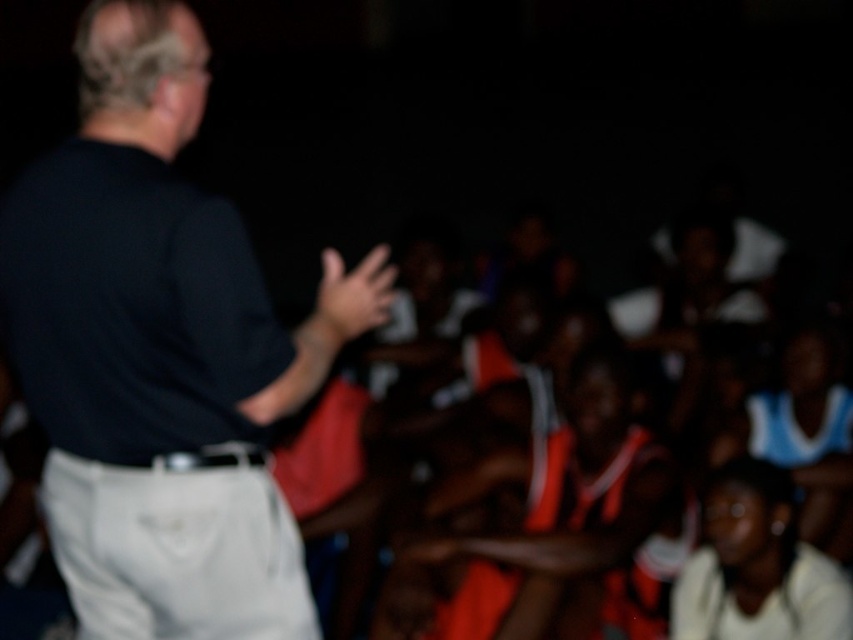
You are standing in the scene and want to find the black matte shirt at upper left. According to the coordinates provided, where exactly should you look?

The black matte shirt at upper left is located at point coordinates 0.556 on the x axis and 0.179 on the y axis.

You are a photographer trying to capture a clear shot of the white matte shirt at lower right and the matte black hand at center. Which object should you focus on to ensure it appears sharp in the photo?

The white matte shirt at lower right is larger in size than the matte black hand at center, so focusing on the white matte shirt at lower right would ensure it appears sharp since it occupies more of the frame.

You are a photographer trying to capture a clear shot of the black matte shirt at upper left and the matte black hand at center. Which object should you focus on first to ensure both are in focus, considering their sizes?

The black matte shirt at upper left is taller than the matte black hand at center, so focusing on the black matte shirt at upper left first will help ensure both are in focus since it is larger and closer to the camera.